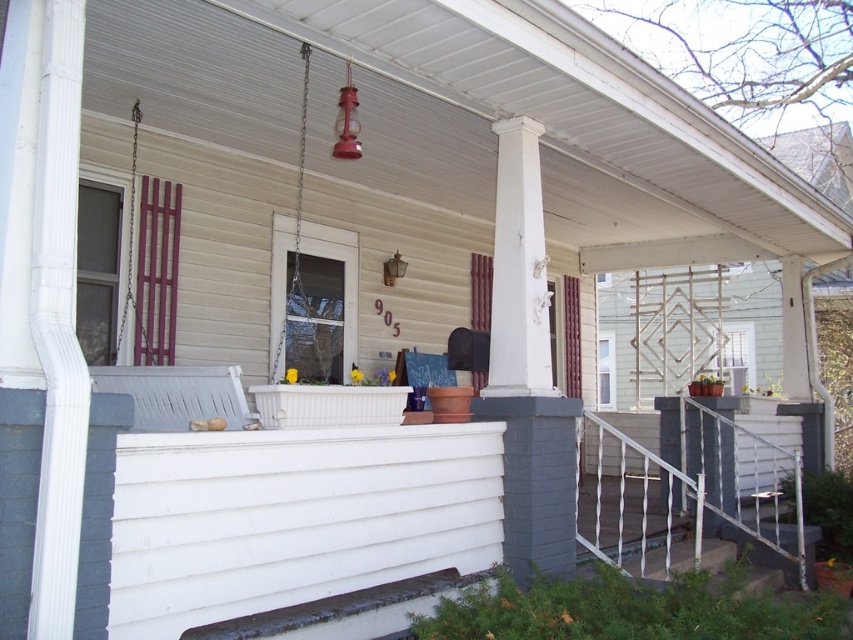
You are a painter who needs to decide which object to paint first. The white metal railing at lower right and the metallic chain swing at center are both in your view. Which object requires more paint because it has a larger surface area?

The white metal railing at lower right requires more paint because it is bigger than the metallic chain swing at center.

In the scene shown: You are a painter who needs to paint the white metal railing at lower right and the metallic chain swing at center. Your ladder can reach up to 3.8 meters. Can you paint both objects without moving the ladder?

The white metal railing at lower right is 3.90 meters from the metallic chain swing at center. Since the ladder can only reach up to 3.8 meters, you cannot paint both objects without moving the ladder because the distance between them exceeds the ladder height.